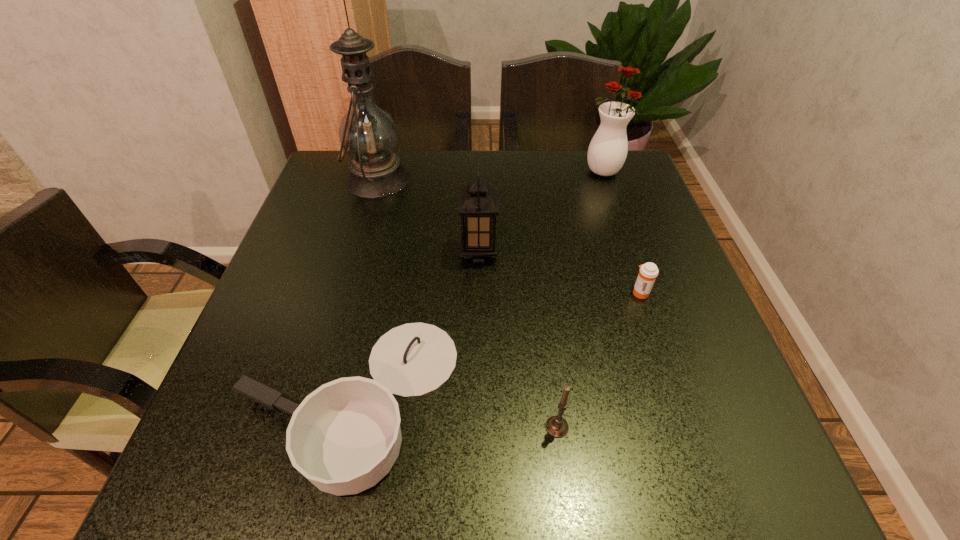
Locate an element on the screen. This screenshot has height=540, width=960. the tallest object is located at coordinates (368, 134).

This screenshot has width=960, height=540. Find the location of `vase`. vase is located at coordinates (607, 152).

Find the location of a particular element. the third farthest object is located at coordinates (478, 205).

At what (x,y) coordinates should I click in order to perform the action: click on candle. Please return your answer as a coordinate pair (x, y). Looking at the image, I should click on (556, 426).

Where is `the fourth object from left to right`? the fourth object from left to right is located at coordinates (556, 426).

Where is `the fourth farthest object`? the fourth farthest object is located at coordinates (648, 272).

The image size is (960, 540). Find the location of `saucepan`. saucepan is located at coordinates (345, 436).

Identify the location of free space located 0.090m on the front of the oil lamp. (363, 228).

You are a GUI agent. You are given a task and a screenshot of the screen. Output one action in this format:
    pyautogui.click(x=<x>, y=<y>)
    Task: Click on the vacant space located on the left of the vase
    
    Given the screenshot: What is the action you would take?
    click(559, 171)

The image size is (960, 540). In order to click on free spot located on the right of the third farthest object in this screenshot , I will do `click(537, 253)`.